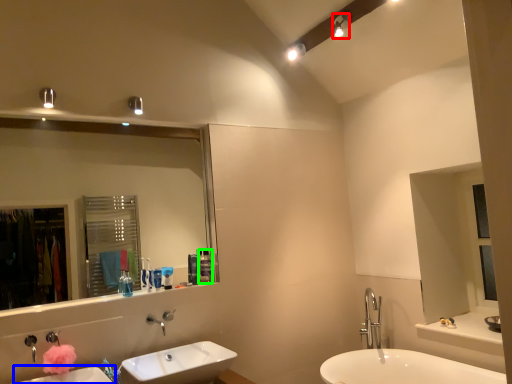
Question: Considering the real-world distances, which object is closest to light fixture (highlighted by a red box)? sink (highlighted by a blue box) or toiletry (highlighted by a green box).

Choices:
 (A) sink
 (B) toiletry

Answer: (B)